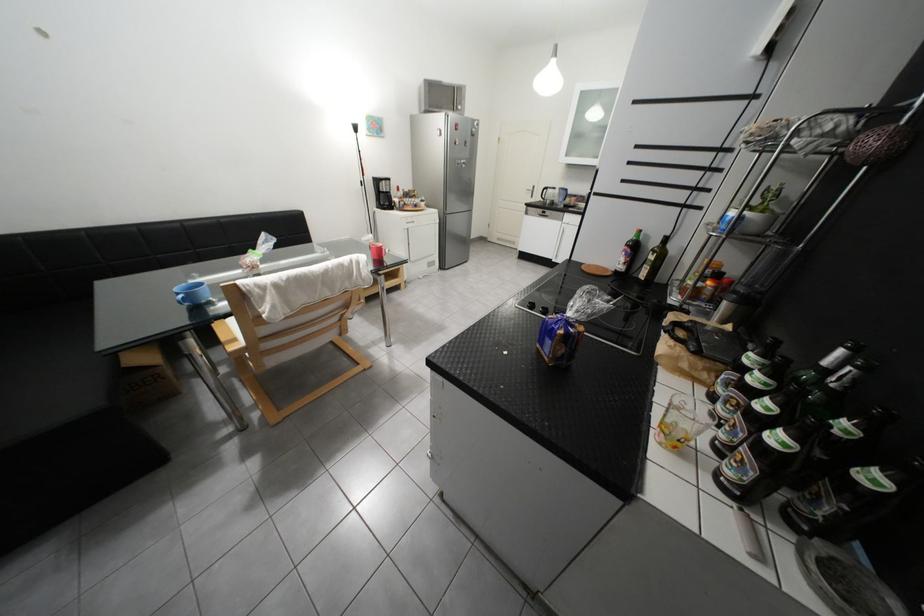
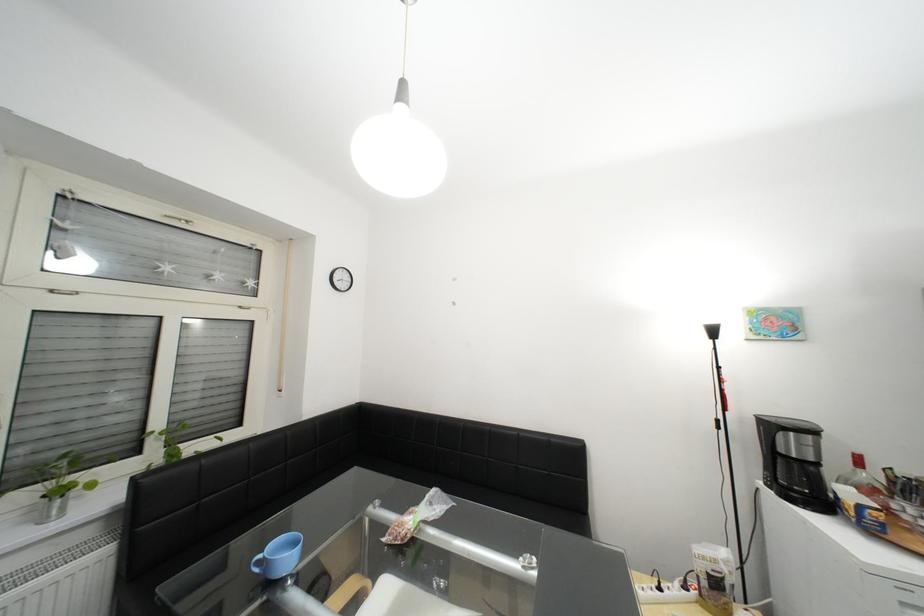
Find the pixel in the second image that matches pixel 412 211 in the first image.

(886, 533)